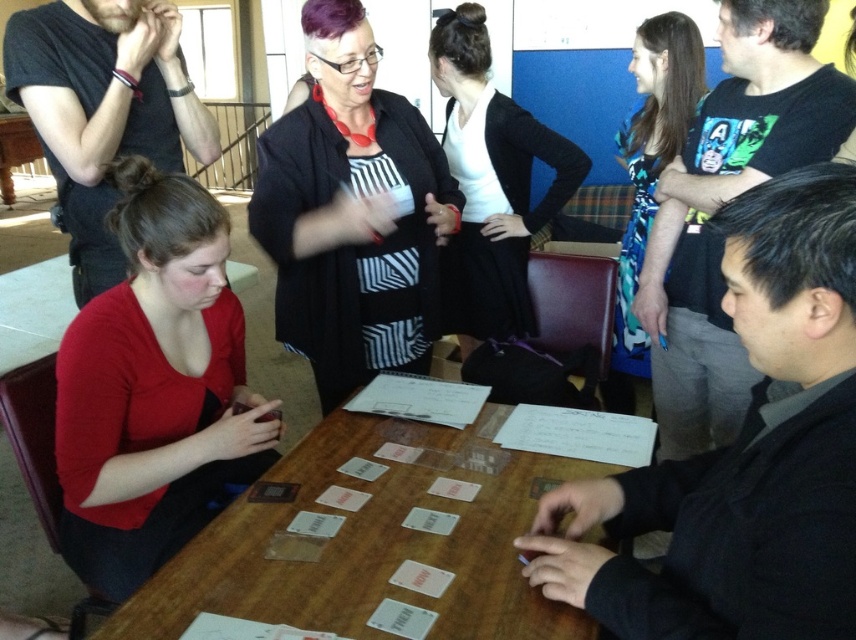
Question: Can you confirm if matte red shirt at lower left is bigger than wooden table at center?

Choices:
 (A) no
 (B) yes

Answer: (B)

Question: Which point is farther to the camera?

Choices:
 (A) matte red shirt at lower left
 (B) black knit cardigan at center
 (C) wooden table at center
 (D) blue floral dress at upper right

Answer: (B)

Question: Among these objects, which one is nearest to the camera?

Choices:
 (A) blue floral dress at upper right
 (B) black knit cardigan at center
 (C) matte red shirt at lower left

Answer: (C)

Question: Can you confirm if matte red shirt at lower left is smaller than blue floral dress at upper right?

Choices:
 (A) no
 (B) yes

Answer: (B)

Question: Among these objects, which one is nearest to the camera?

Choices:
 (A) black knit cardigan at center
 (B) wooden table at center

Answer: (B)

Question: Considering the relative positions of black knit cardigan at center and blue floral dress at upper right in the image provided, where is black knit cardigan at center located with respect to blue floral dress at upper right?

Choices:
 (A) above
 (B) below

Answer: (A)